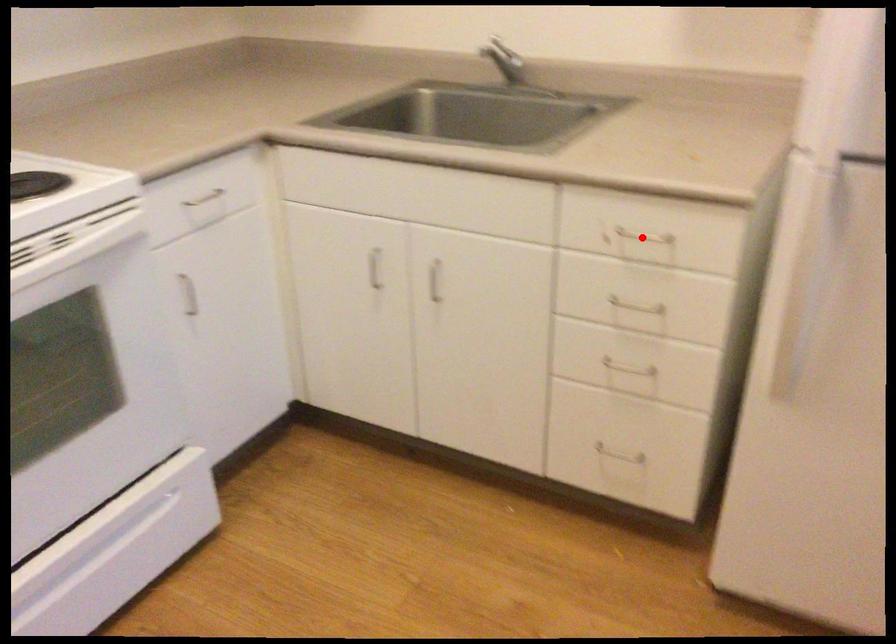
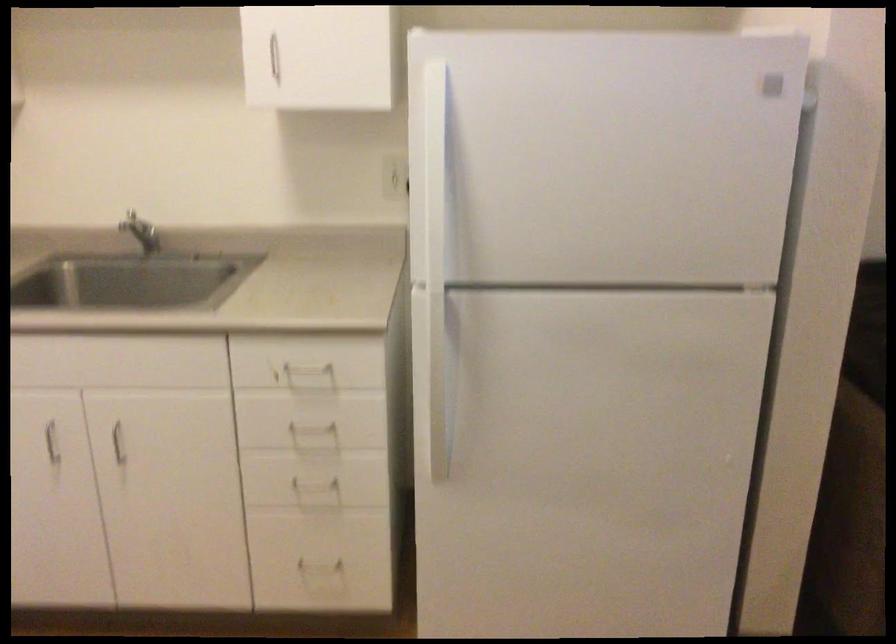
Question: A red point is marked in image1. In image2, is the corresponding 3D point closer to the camera or farther? Reply with the corresponding letter.

Choices:
 (A) The corresponding 3D point is closer.
 (B) The corresponding 3D point is farther.

Answer: (B)